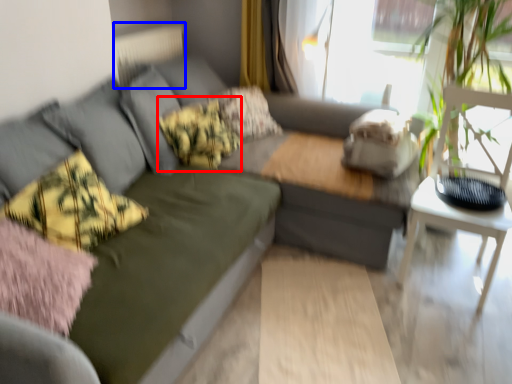
Question: Which object is further to the camera taking this photo, pillow (highlighted by a red box) or radiator (highlighted by a blue box)?

Choices:
 (A) pillow
 (B) radiator

Answer: (B)